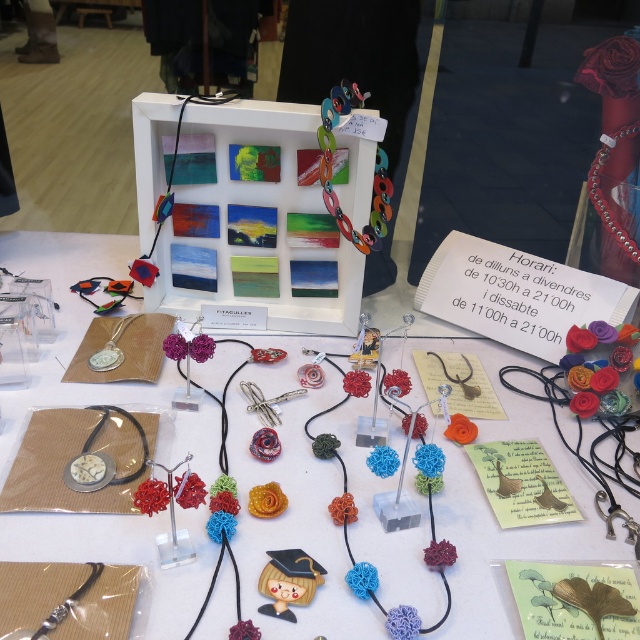
Question: Can you confirm if matte silver watch at center is positioned to the right of leather beaded necklace at upper right?

Choices:
 (A) no
 (B) yes

Answer: (A)

Question: Observing the image, what is the correct spatial positioning of matte silver watch at center in reference to silver metallic spoon at center-left?

Choices:
 (A) left
 (B) right

Answer: (B)

Question: Is leather beaded necklace at upper right bigger than silver metallic bracelet at lower left?

Choices:
 (A) yes
 (B) no

Answer: (A)

Question: Which point is farther from the camera taking this photo?

Choices:
 (A) (54, 625)
 (B) (90, 467)
 (C) (426, 595)
 (D) (88, 364)

Answer: (D)

Question: Which point is closer to the camera?

Choices:
 (A) (588, 186)
 (B) (54, 609)

Answer: (B)

Question: Which object is closer to the camera taking this photo?

Choices:
 (A) leather beaded necklace at upper right
 (B) silver metallic bracelet at lower left

Answer: (B)